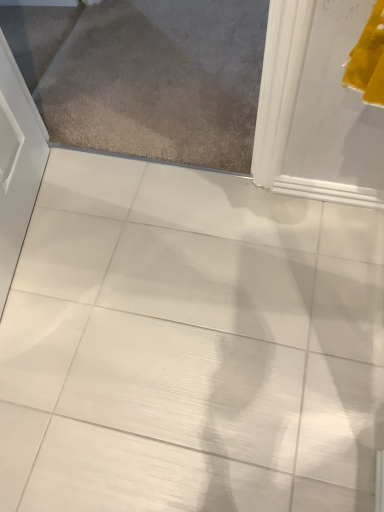
Question: Considering their positions, is white glossy tile at center located in front of or behind matte gray carpet at upper left?

Choices:
 (A) front
 (B) behind

Answer: (A)

Question: From a real-world perspective, is white glossy tile at center positioned above or below matte gray carpet at upper left?

Choices:
 (A) below
 (B) above

Answer: (A)

Question: Looking at the image, does white glossy tile at center seem bigger or smaller compared to matte gray carpet at upper left?

Choices:
 (A) big
 (B) small

Answer: (A)

Question: Is matte gray carpet at upper left wider or thinner than white glossy tile at center?

Choices:
 (A) wide
 (B) thin

Answer: (A)

Question: Relative to white glossy tile at center, is matte gray carpet at upper left in front or behind?

Choices:
 (A) front
 (B) behind

Answer: (B)

Question: From a real-world perspective, relative to white glossy tile at center, is matte gray carpet at upper left vertically above or below?

Choices:
 (A) above
 (B) below

Answer: (A)

Question: From the image's perspective, is matte gray carpet at upper left positioned above or below white glossy tile at center?

Choices:
 (A) below
 (B) above

Answer: (B)